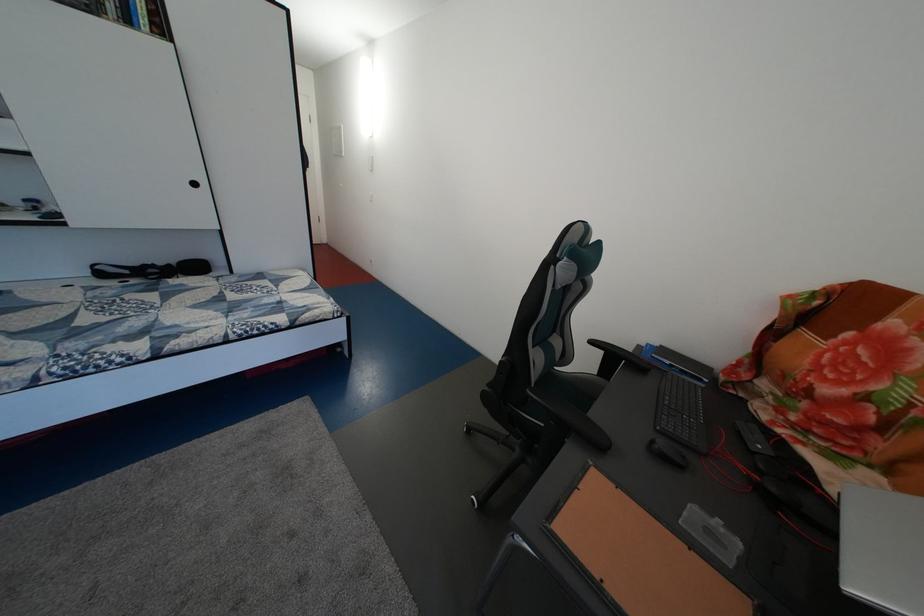
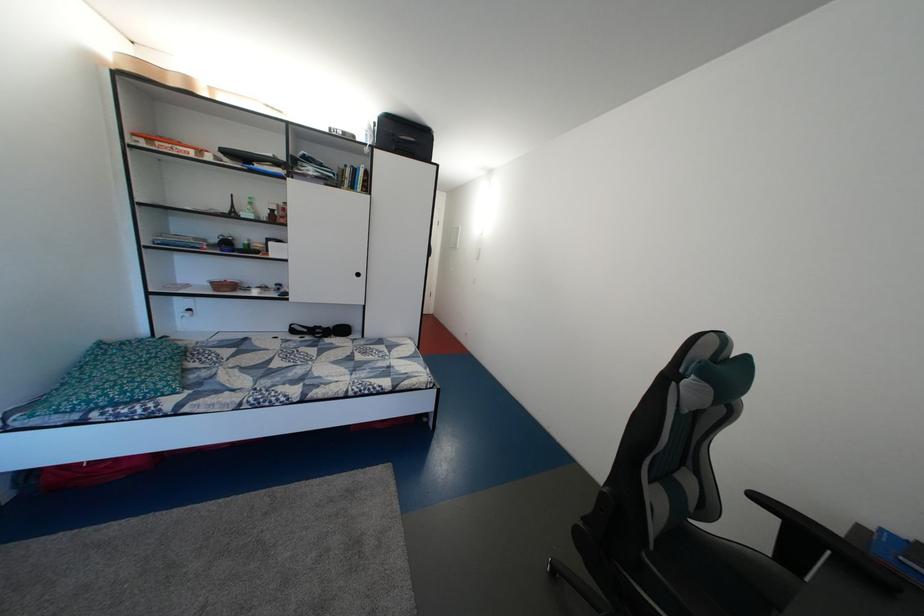
Question: The images are taken continuously from a first-person perspective. In which direction is your viewpoint rotating?

Choices:
 (A) Left
 (B) Right
 (C) Up
 (D) Down

Answer: (A)